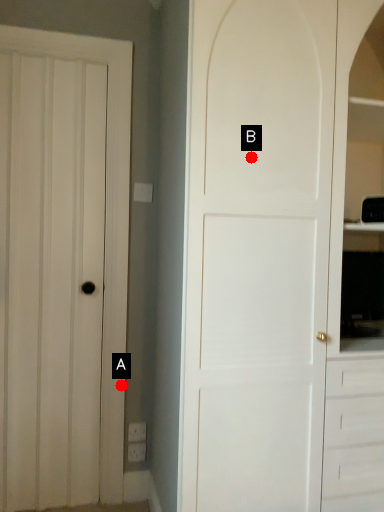
Question: Two points are circled on the image, labeled by A and B beside each circle. Which point is closer to the camera?

Choices:
 (A) A is closer
 (B) B is closer

Answer: (B)